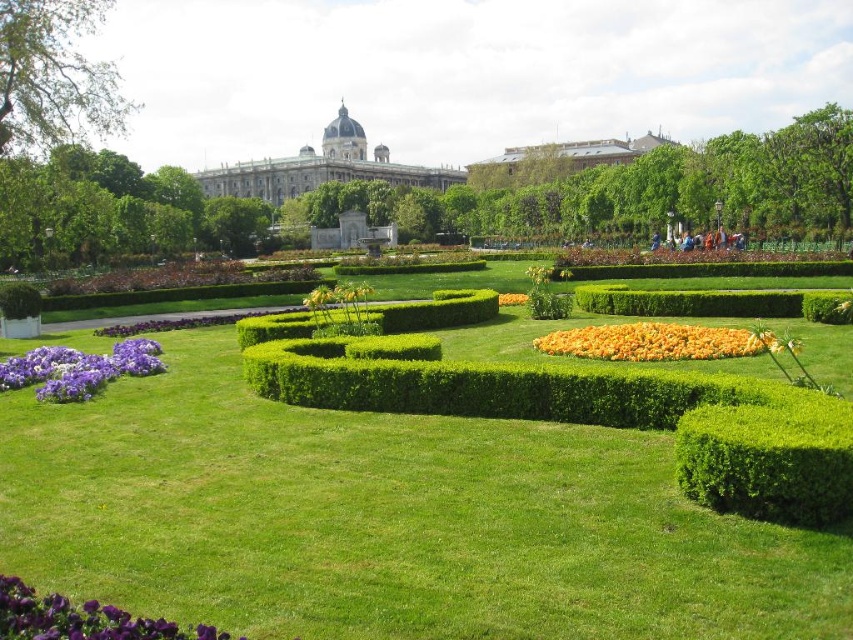
You are standing in the garden and want to know how far you are from the point labeled as point [341,136]. Can you determine the distance?

The distance between you and point [341,136] is 236.65 meters.

You are a landscape architect designing a new garden. You need to place a statue that is 10 feet wide between the purple matte flower at lower left and the green leafy hedge at center. Is there enough space between them for the statue?

The distance between the purple matte flower at lower left and the green leafy hedge at center is 121.97 feet. Since the statue is only 10 feet wide, there is ample space to place it between them.